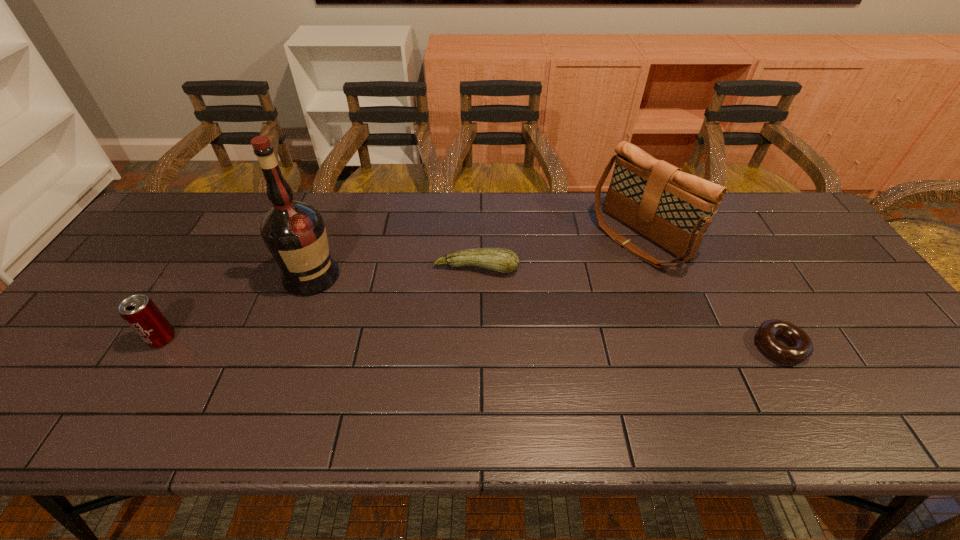
Where is `vacant space located 0.230m on the right of the beer can`? The width and height of the screenshot is (960, 540). vacant space located 0.230m on the right of the beer can is located at coordinates [271, 339].

The width and height of the screenshot is (960, 540). Identify the location of vacant space positioned 0.400m on the left of the shortest object. (587, 346).

What are the coordinates of `vacant space located 0.380m on the surface of the second object from left to right` in the screenshot? It's located at (420, 377).

Where is `vacant region located 0.290m on the surface of the second object from left to right`? vacant region located 0.290m on the surface of the second object from left to right is located at coordinates (396, 354).

The width and height of the screenshot is (960, 540). Find the location of `free space located on the surface of the second object from left to right`. free space located on the surface of the second object from left to right is located at coordinates (344, 307).

Locate an element on the screen. free space located at the stem end of the third object from left to right is located at coordinates point(449,380).

Where is `free location located 0.220m at the stem end of the third object from left to right`? This screenshot has width=960, height=540. free location located 0.220m at the stem end of the third object from left to right is located at coordinates (457, 344).

The image size is (960, 540). Identify the location of vacant space situated 0.070m at the stem end of the third object from left to right. (467, 298).

Where is `free space located 0.370m on the front-facing side of the fourth shortest object`? The height and width of the screenshot is (540, 960). free space located 0.370m on the front-facing side of the fourth shortest object is located at coordinates (515, 326).

Where is `vacant space situated 0.390m on the front-facing side of the fourth shortest object`? The height and width of the screenshot is (540, 960). vacant space situated 0.390m on the front-facing side of the fourth shortest object is located at coordinates (509, 329).